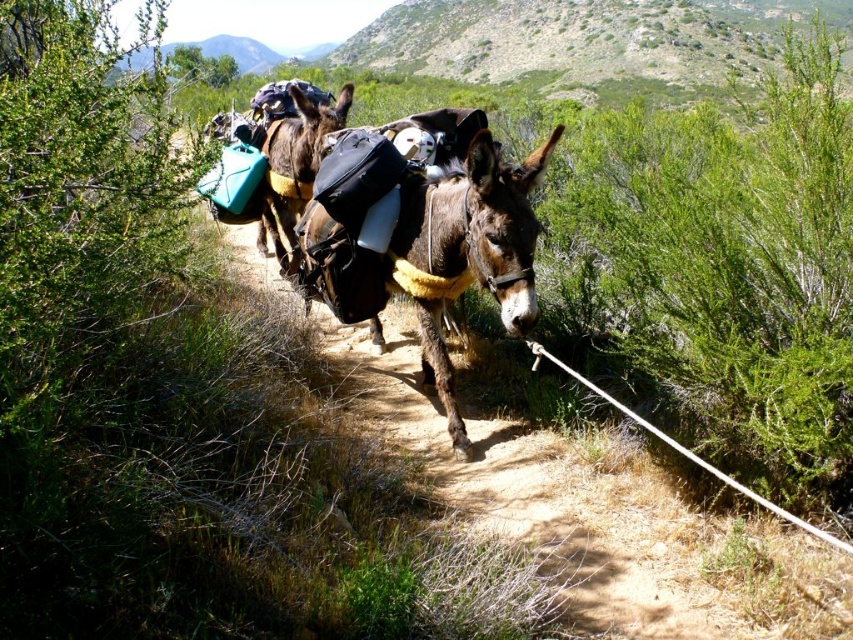
Question: Is brown fuzzy pack at center thinner than brown leather saddlebags at center?

Choices:
 (A) no
 (B) yes

Answer: (A)

Question: Which point is farther to the camera?

Choices:
 (A) (x=309, y=163)
 (B) (x=506, y=314)

Answer: (A)

Question: Among these points, which one is farthest from the camera?

Choices:
 (A) (265, 198)
 (B) (323, 253)

Answer: (A)

Question: Does brown fuzzy pack at center appear over brown leather saddlebags at center?

Choices:
 (A) yes
 (B) no

Answer: (B)

Question: In this image, where is brown fuzzy pack at center located relative to brown leather saddlebags at center?

Choices:
 (A) left
 (B) right

Answer: (B)

Question: Which object appears closest to the camera in this image?

Choices:
 (A) brown leather saddlebags at center
 (B) brown fuzzy pack at center

Answer: (B)